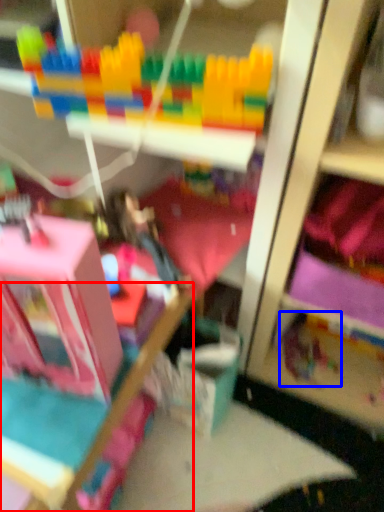
Question: Which object appears closest to the camera in this image, bed frame (highlighted by a red box) or toy (highlighted by a blue box)?

Choices:
 (A) bed frame
 (B) toy

Answer: (A)